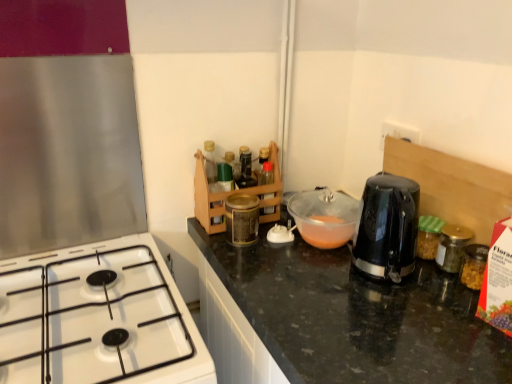
Question: Is translucent plastic bowl at center beside gold metallic jar at right?

Choices:
 (A) yes
 (B) no

Answer: (B)

Question: From a real-world perspective, is translucent plastic bowl at center under gold metallic jar at right?

Choices:
 (A) no
 (B) yes

Answer: (A)

Question: Is gold metallic jar at right inside translucent plastic bowl at center?

Choices:
 (A) yes
 (B) no

Answer: (B)

Question: Does translucent plastic bowl at center have a larger size compared to gold metallic jar at right?

Choices:
 (A) no
 (B) yes

Answer: (B)

Question: Is translucent plastic bowl at center thinner than gold metallic jar at right?

Choices:
 (A) no
 (B) yes

Answer: (A)

Question: Looking at their shapes, would you say translucent plastic bowl at center is wider or thinner than gold metallic jar at right?

Choices:
 (A) thin
 (B) wide

Answer: (B)

Question: Considering the positions of translucent plastic bowl at center and gold metallic jar at right in the image, is translucent plastic bowl at center bigger or smaller than gold metallic jar at right?

Choices:
 (A) small
 (B) big

Answer: (B)

Question: From a real-world perspective, relative to gold metallic jar at right, is translucent plastic bowl at center vertically above or below?

Choices:
 (A) below
 (B) above

Answer: (B)

Question: From the image's perspective, is translucent plastic bowl at center positioned above or below gold metallic jar at right?

Choices:
 (A) below
 (B) above

Answer: (B)

Question: Is point (169, 334) closer or farther from the camera than point (358, 205)?

Choices:
 (A) closer
 (B) farther

Answer: (A)

Question: In terms of size, does white glossy gas stove at lower left appear bigger or smaller than translucent plastic bowl at center?

Choices:
 (A) big
 (B) small

Answer: (A)

Question: Is white glossy gas stove at lower left inside or outside of translucent plastic bowl at center?

Choices:
 (A) outside
 (B) inside

Answer: (A)

Question: Considering the positions of white glossy gas stove at lower left and translucent plastic bowl at center in the image, is white glossy gas stove at lower left taller or shorter than translucent plastic bowl at center?

Choices:
 (A) tall
 (B) short

Answer: (A)

Question: Considering the positions of white glossy gas stove at lower left and gold metallic jar at right in the image, is white glossy gas stove at lower left wider or thinner than gold metallic jar at right?

Choices:
 (A) thin
 (B) wide

Answer: (B)

Question: From their relative heights in the image, would you say white glossy gas stove at lower left is taller or shorter than gold metallic jar at right?

Choices:
 (A) short
 (B) tall

Answer: (B)